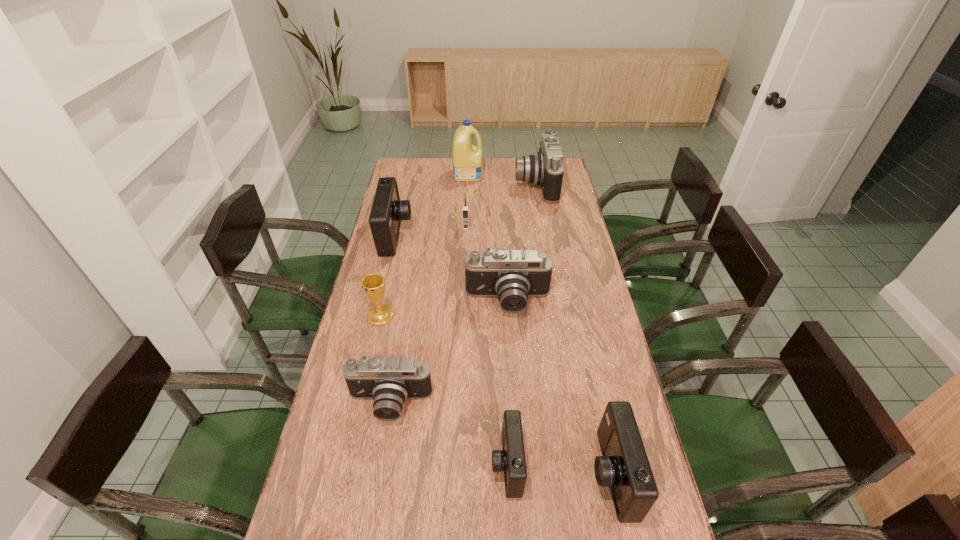
Find the location of a particular element. The image size is (960, 540). detergent is located at coordinates (467, 159).

Locate an element on the screen. the farthest black camera is located at coordinates (545, 168).

Find the location of a particular element. the farthest camera is located at coordinates point(545,168).

Image resolution: width=960 pixels, height=540 pixels. What are the coordinates of `the farthest blue camera` in the screenshot? It's located at (387, 212).

Identify the location of the biggest blue camera. (387, 212).

You are a GUI agent. You are given a task and a screenshot of the screen. Output one action in this format:
    pyautogui.click(x=<x>, y=<y>)
    Task: Click on the second nearest black camera
    Image resolution: width=960 pixels, height=540 pixels.
    Given the screenshot: What is the action you would take?
    pyautogui.click(x=512, y=275)

The height and width of the screenshot is (540, 960). Identify the location of the second biggest black camera. (512, 275).

This screenshot has width=960, height=540. Find the location of `cellular telephone`. cellular telephone is located at coordinates (465, 212).

Identify the location of gold chalice. This screenshot has height=540, width=960. (373, 285).

You are a GUI agent. You are given a task and a screenshot of the screen. Output one action in this format:
    pyautogui.click(x=<x>, y=<y>)
    Task: Click on the rightmost blue camera
    This screenshot has height=540, width=960.
    Given the screenshot: What is the action you would take?
    pyautogui.click(x=624, y=466)